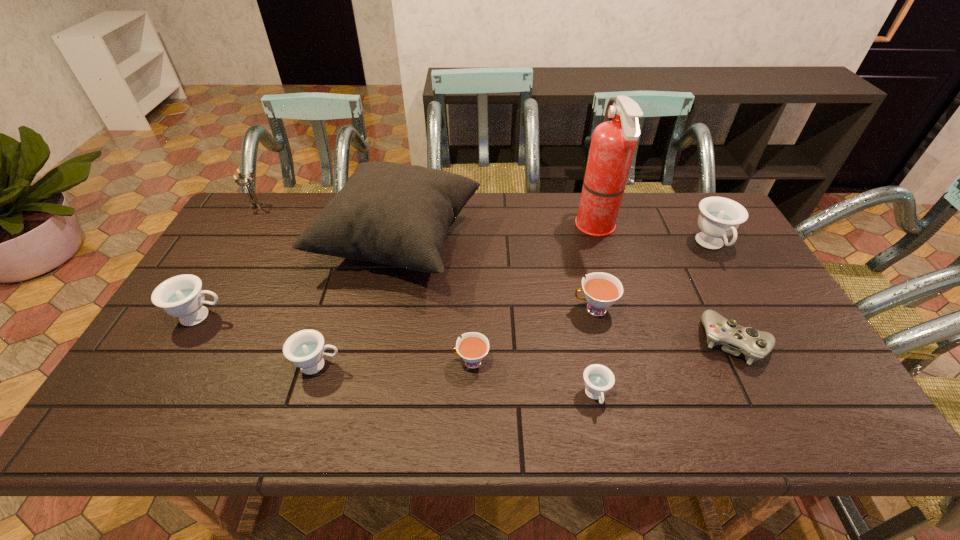
Identify the location of vacant space situated 0.210m on the left of the ninth shortest object. The width and height of the screenshot is (960, 540). (251, 243).

Locate an element on the screen. Image resolution: width=960 pixels, height=540 pixels. vacant space located on the right of the candle holder is located at coordinates (363, 206).

Image resolution: width=960 pixels, height=540 pixels. I want to click on blank area located on the side of the farthest teacup with the handle, so click(750, 314).

This screenshot has width=960, height=540. Identify the location of vacant region located on the side of the third nearest blue teacup with the handle. (338, 316).

Find the location of a particular element. Image resolution: width=960 pixels, height=540 pixels. vacant space situated 0.150m on the side of the bigger white teacup with the handle is located at coordinates (516, 309).

In order to click on vacant space located 0.380m on the side of the bigger white teacup with the handle in this screenshot , I will do `click(432, 309)`.

The height and width of the screenshot is (540, 960). Find the location of `vacant area situated 0.310m on the side of the bigger white teacup with the handle`. vacant area situated 0.310m on the side of the bigger white teacup with the handle is located at coordinates (457, 309).

This screenshot has height=540, width=960. Find the location of `vacant position located on the side of the second smallest blue teacup with the handle`. vacant position located on the side of the second smallest blue teacup with the handle is located at coordinates (389, 365).

Image resolution: width=960 pixels, height=540 pixels. Find the location of `vacant space located on the back of the control`. vacant space located on the back of the control is located at coordinates (708, 291).

You are a GUI agent. You are given a task and a screenshot of the screen. Output one action in this format:
    pyautogui.click(x=<x>, y=<y>)
    Task: Click on the vacant space situated on the side of the third teacup from left to right with the handle
    The image size is (960, 540).
    Given the screenshot: What is the action you would take?
    pyautogui.click(x=416, y=362)